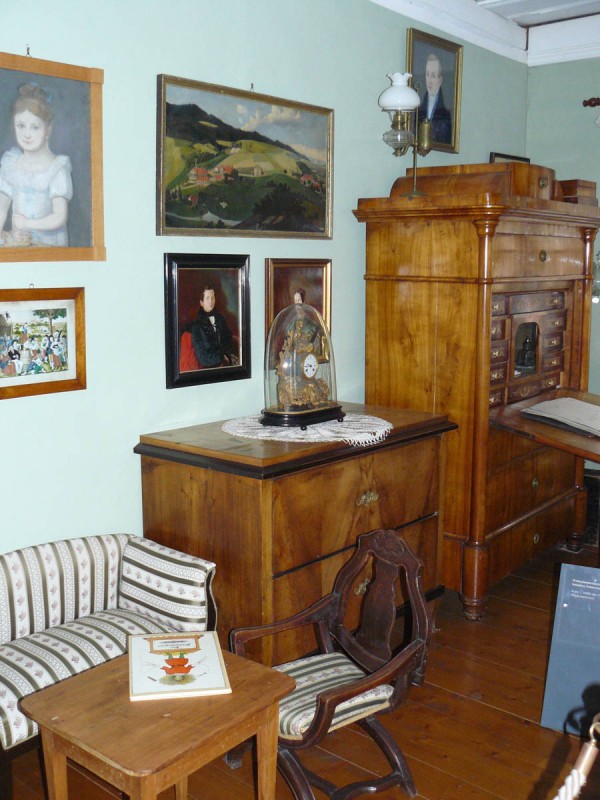
Identify the location of table. (146, 734).